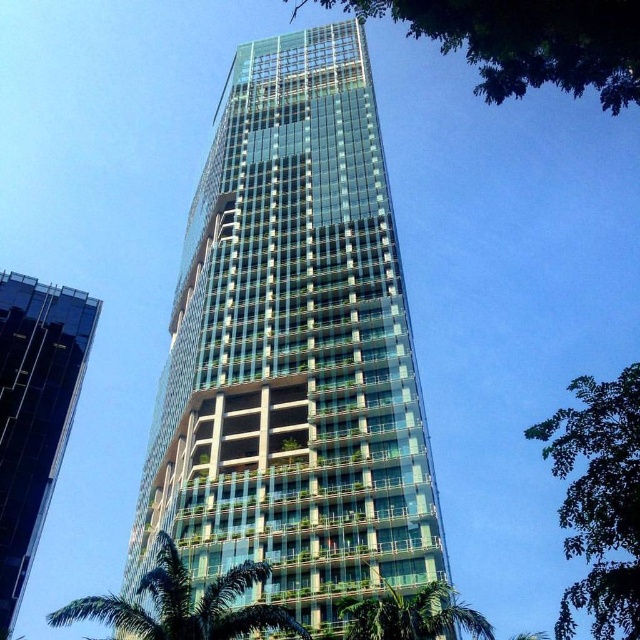
You are standing in a park and see the transparent glass building at center and the green leafy palm tree at lower center. Which object is more to the left?

The transparent glass building at center is more to the left than the green leafy palm tree at lower center.

You are standing in front of the skyscraper and want to locate both the green leafy tree at upper right and the green leafy palm tree at lower center. Which tree is positioned to the right side of the other?

The green leafy tree at upper right is positioned to the right of the green leafy palm tree at lower center.

You are standing in front of the skyscraper and see the green leafy tree at upper center and the green leafy palm tree at lower center. Which tree is located to the right of the other?

The green leafy tree at upper center is positioned on the right side of the green leafy palm tree at lower center.